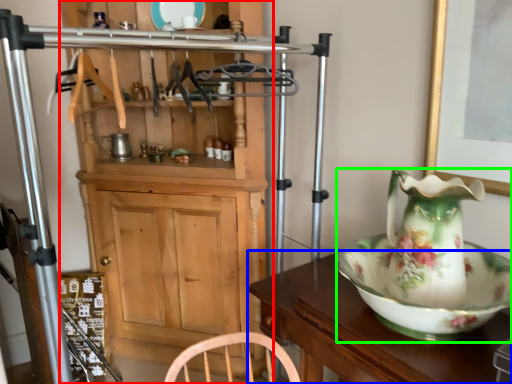
Question: Which object is the closest to the cabinetry (highlighted by a red box)? Choose among these: table (highlighted by a blue box) or jug (highlighted by a green box).

Choices:
 (A) table
 (B) jug

Answer: (A)